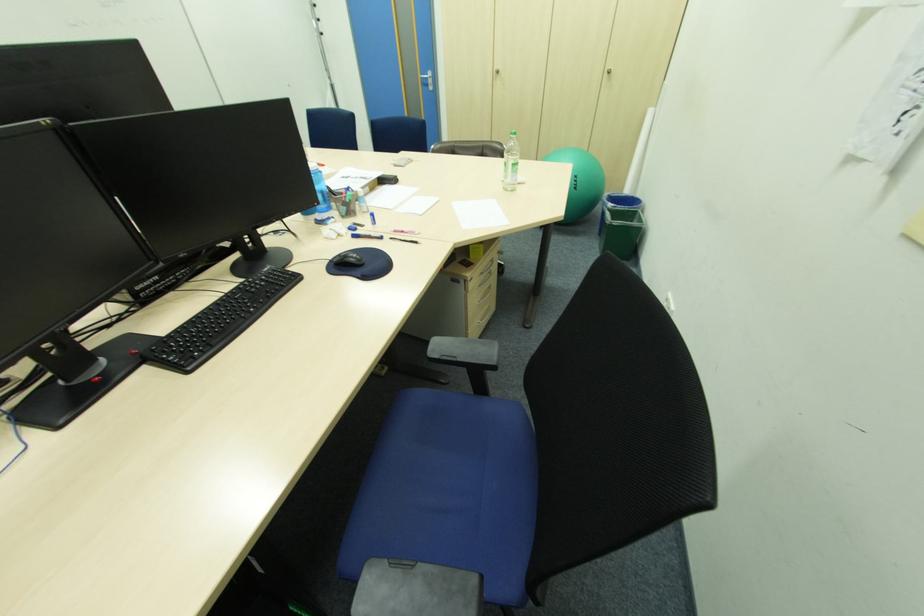
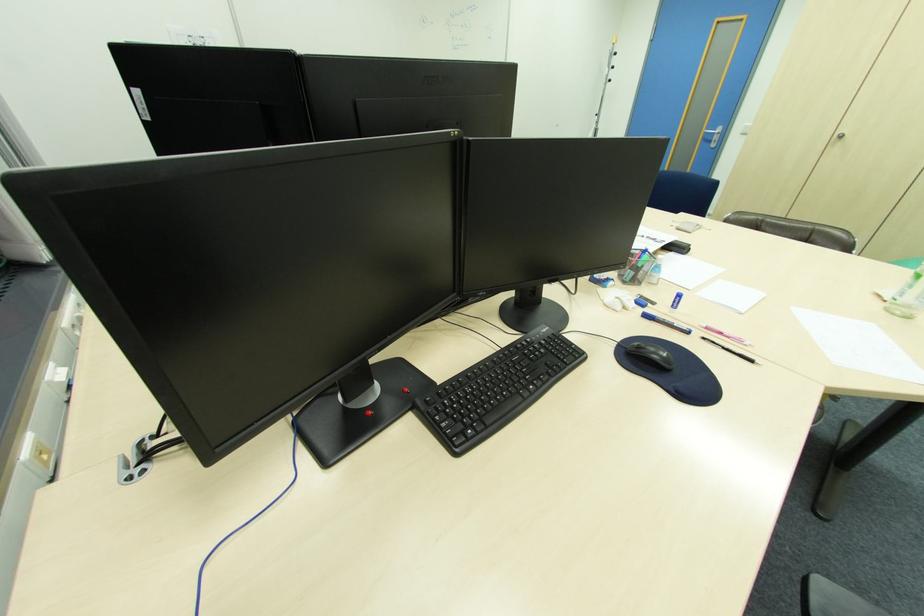
Locate, in the second image, the point that corresponds to point (511, 190) in the first image.

(894, 310)